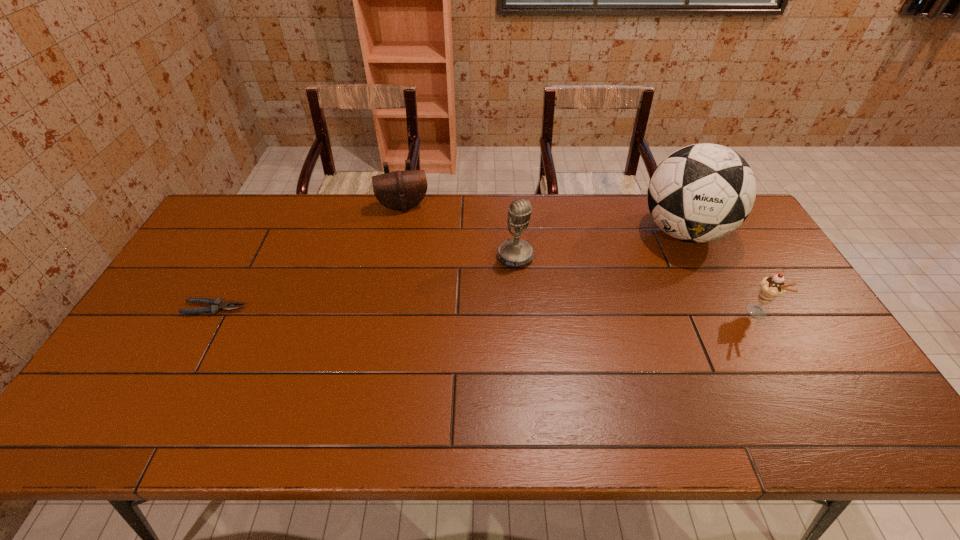
The image size is (960, 540). I want to click on the leftmost object, so click(217, 304).

The width and height of the screenshot is (960, 540). In order to click on the shortest object in this screenshot , I will do point(217,304).

The image size is (960, 540). Find the location of `icecream`. icecream is located at coordinates (772, 287).

Where is `pouch`? Image resolution: width=960 pixels, height=540 pixels. pouch is located at coordinates [x=401, y=190].

At what (x,y) coordinates should I click in order to perform the action: click on the second tallest object. Please return your answer as a coordinate pair (x, y). Looking at the image, I should click on (515, 252).

Where is `microphone`? microphone is located at coordinates (515, 252).

Where is `the tallest object`? Image resolution: width=960 pixels, height=540 pixels. the tallest object is located at coordinates pos(702,192).

At what (x,y) coordinates should I click in order to perform the action: click on free space located at the gripping part of the shortest object. Please return your answer as a coordinate pair (x, y). Looking at the image, I should click on (338, 308).

This screenshot has height=540, width=960. I want to click on vacant space situated on the back of the icecream, so click(x=726, y=259).

The height and width of the screenshot is (540, 960). I want to click on vacant area situated 0.140m with the flap open on the pouch, so click(413, 240).